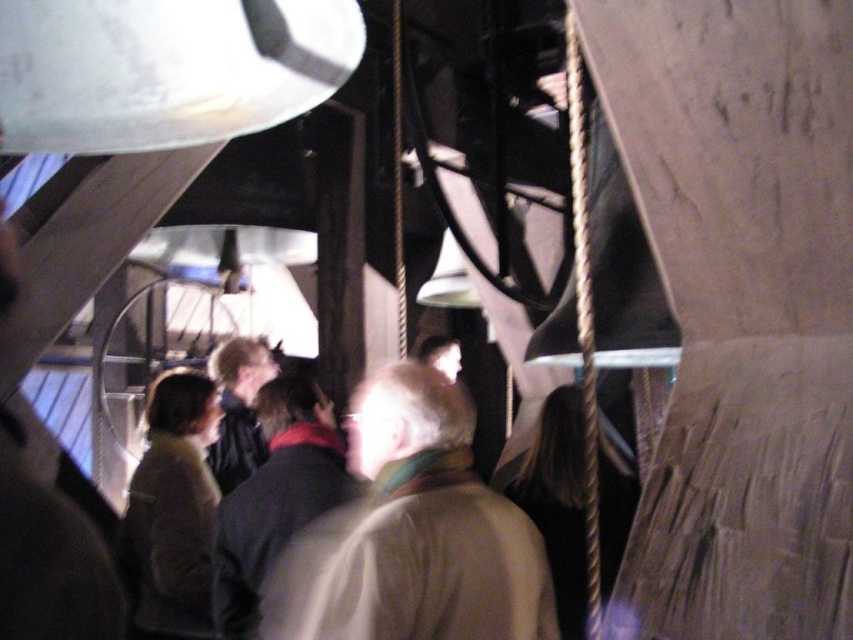
You are a GUI agent. You are given a task and a screenshot of the screen. Output one action in this format:
    pyautogui.click(x=<x>, y=<y>)
    Task: Click on the light brown leather jacket at center
    The image size is (853, 640).
    Given the screenshot: What is the action you would take?
    pyautogui.click(x=413, y=532)

Does light brown leather jacket at center have a greater height compared to gold metallic rope at right?

No.

Locate an element on the screen. light brown leather jacket at center is located at coordinates (413, 532).